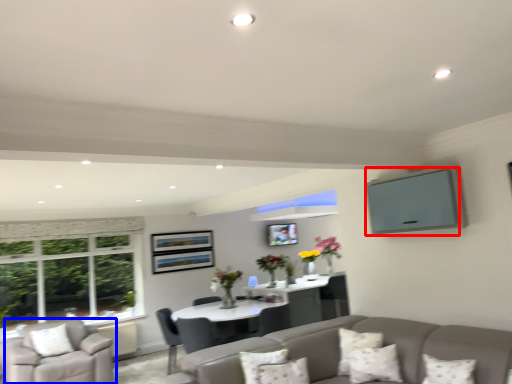
Question: Which object appears farthest to the camera in this image, window screen (highlighted by a red box) or chair (highlighted by a blue box)?

Choices:
 (A) window screen
 (B) chair

Answer: (B)